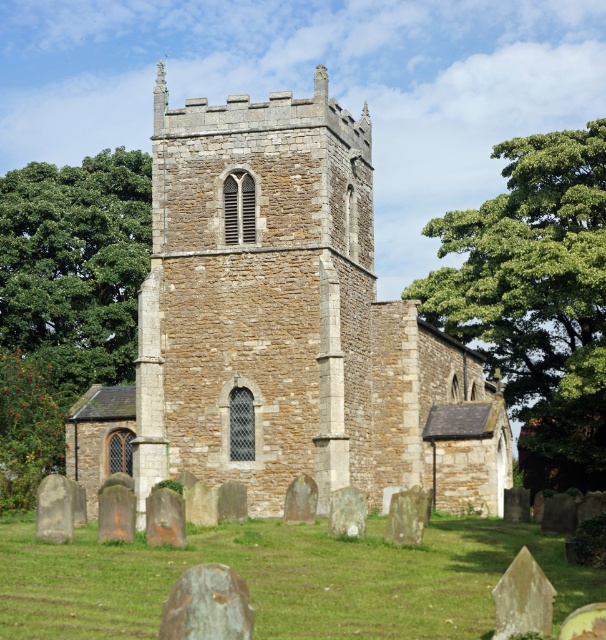
Question: Estimate the real-world distances between objects in this image. Which object is farther from the green leafy tree at left?

Choices:
 (A) green leafy tree at upper right
 (B) brown stone church at center

Answer: (A)

Question: Where is brown stone church at center located in relation to green leafy tree at upper right in the image?

Choices:
 (A) left
 (B) right

Answer: (A)

Question: Which of the following is the farthest from the observer?

Choices:
 (A) green leafy tree at left
 (B) brown stone church at center
 (C) green leafy tree at upper right

Answer: (A)

Question: Does brown stone church at center have a larger size compared to green leafy tree at upper right?

Choices:
 (A) yes
 (B) no

Answer: (A)

Question: Where is brown stone church at center located in relation to green leafy tree at upper right in the image?

Choices:
 (A) above
 (B) below

Answer: (A)

Question: Based on their relative distances, which object is farther from the brown stone church at center?

Choices:
 (A) green leafy tree at left
 (B) green leafy tree at upper right

Answer: (A)